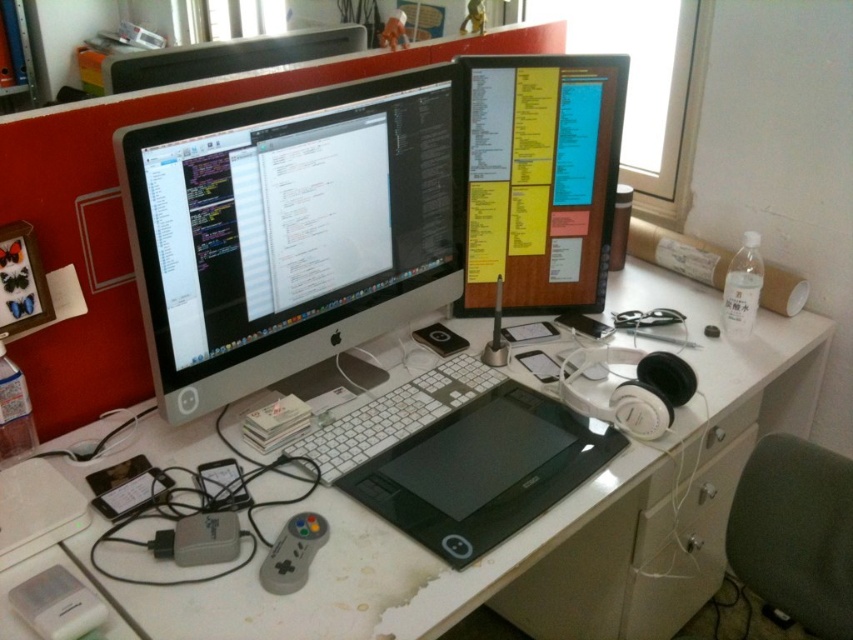
You are a person who is 160 cm tall and you are sitting at the white plastic computer desk at center. The black matte drawing tablet at center is placed on the desk. Do you think the height of the desk allows you to use the tablet comfortably?

The white plastic computer desk at center is much taller than the black matte drawing tablet at center. Since the desk is taller, it might be uncomfortable for a shorter person like you to use the tablet comfortably as it may require you to reach up or hunch over.

You are a drone operator trying to navigate a small drone between two points in the workspace. The first point is at coordinate point(538, 156) and the second point is at point(312, 51). Which point should you aim for first if you want to reach the closer one to the viewer?

Point(538, 156) is closer to the viewer than point(312, 51), so you should aim for point(538, 156) first.